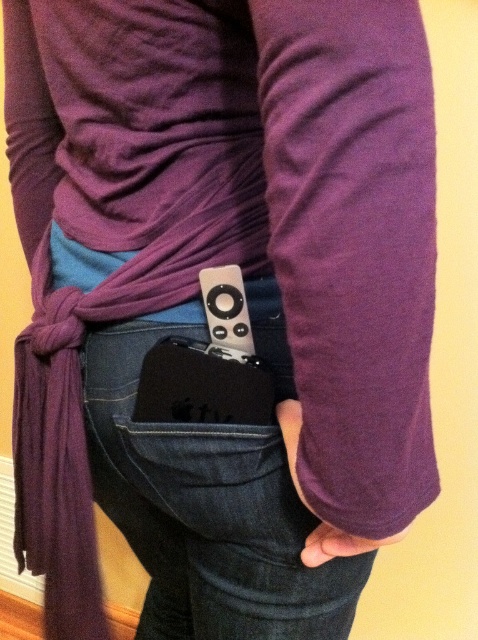
Locate an element on the screen. The height and width of the screenshot is (640, 478). denim at lower center is located at coordinates (206, 512).

Can you confirm if denim at lower center is smaller than purple matte hand at lower center?

Incorrect, denim at lower center is not smaller in size than purple matte hand at lower center.

Image resolution: width=478 pixels, height=640 pixels. In order to click on denim at lower center in this screenshot , I will do `click(206, 512)`.

Can you confirm if denim at lower center is taller than satin black remote at center?

Indeed, denim at lower center has a greater height compared to satin black remote at center.

Between point (132, 333) and point (209, 352), which one is positioned behind?

Point (132, 333)

At what (x,y) coordinates should I click in order to perform the action: click on denim at lower center. Please return your answer as a coordinate pair (x, y). Looking at the image, I should click on (206, 512).

Does purple fabric scarf at center have a lesser width compared to purple soft hand at lower center?

Incorrect, purple fabric scarf at center's width is not less than purple soft hand at lower center's.

Is purple fabric scarf at center taller than purple soft hand at lower center?

Yes.

Is point (265, 278) positioned after point (381, 540)?

Yes, point (265, 278) is farther from viewer.

Locate an element on the screen. purple fabric scarf at center is located at coordinates (79, 262).